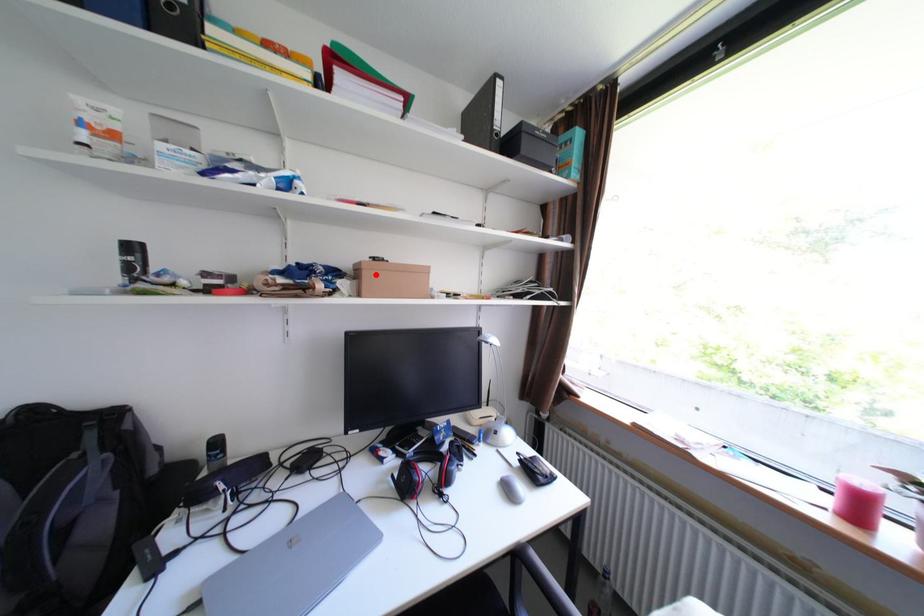
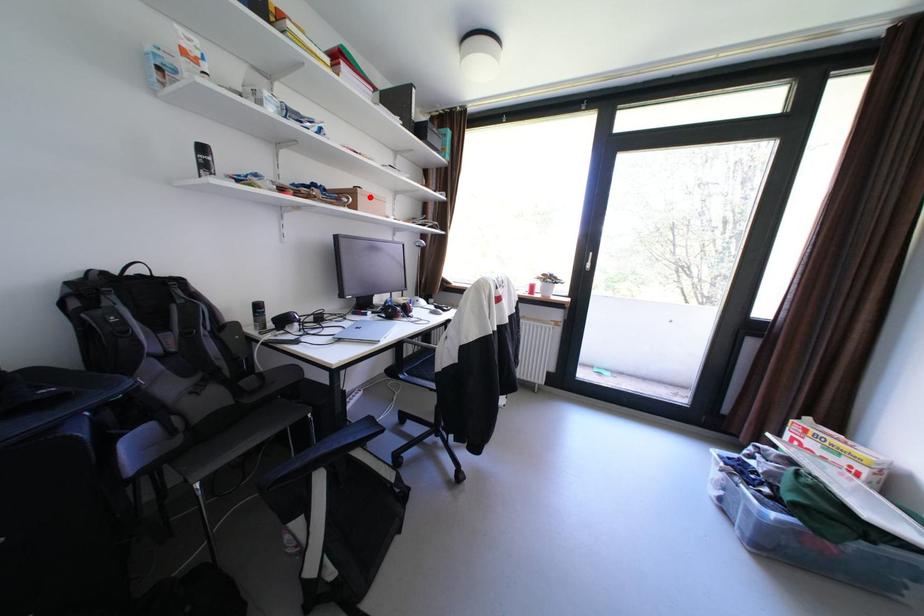
I am providing you with two images of the same scene from different viewpoints. A red point is marked on the first image and another point is marked on the second image. Is the marked point in image1 the same physical position as the marked point in image2?

Yes